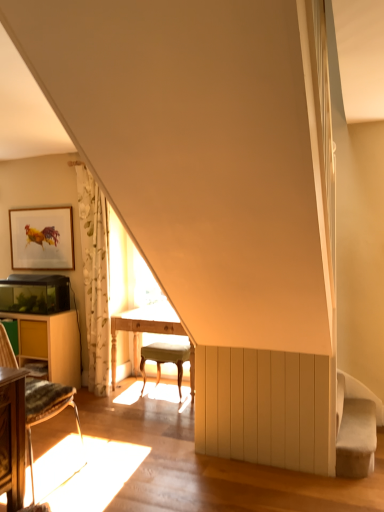
Where is `vacant space situated above gold-framed artwork at upper left (from a real-world perspective)`? The height and width of the screenshot is (512, 384). vacant space situated above gold-framed artwork at upper left (from a real-world perspective) is located at coordinates [45, 200].